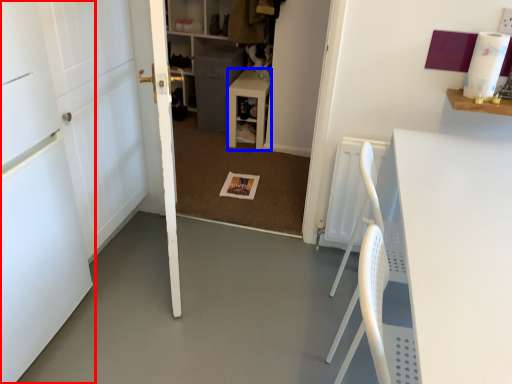
Question: Which of the following is the closest to the observer, door (highlighted by a red box) or table (highlighted by a blue box)?

Choices:
 (A) door
 (B) table

Answer: (A)